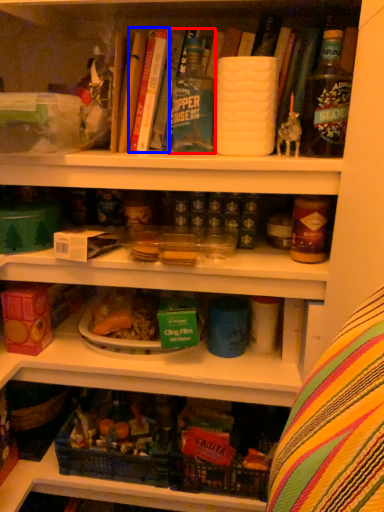
Question: Among these objects, which one is nearest to the camera, bottle (highlighted by a red box) or book (highlighted by a blue box)?

Choices:
 (A) bottle
 (B) book

Answer: (A)